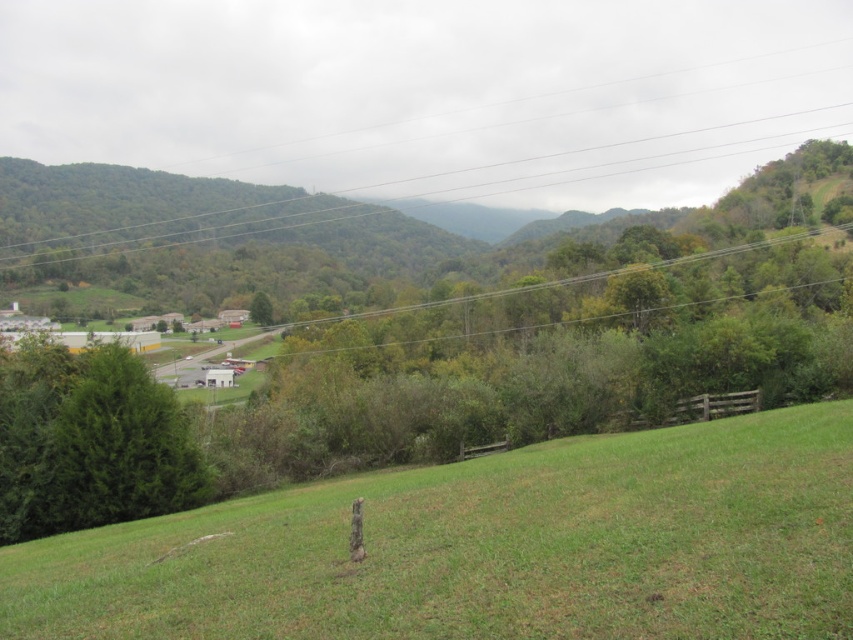
You are standing at the edge of the green grassy field at center and want to walk towards the green matte tree at lower left. Which direction should you head?

You should head towards the green matte tree at lower left, which is located behind the green grassy field at center according to the description.

You are standing at the edge of the green grassy field at center and want to look up to see the green matte tree at center. In which direction should you look?

You should look upward because the green grassy field at center is located below the green matte tree at center.

You are standing at the edge of the green grassy field at center and want to walk to the green matte tree at lower left. Which direction should you face to move towards it?

You should face to the left because the green matte tree at lower left is to the left of the green grassy field at center.